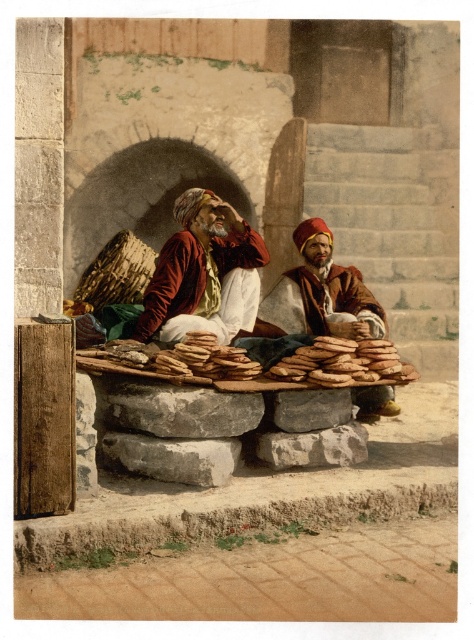
Question: Is matte red turban at center wider than brown leather turban at center?

Choices:
 (A) yes
 (B) no

Answer: (B)

Question: Is matte red turban at center in front of brown leather turban at center?

Choices:
 (A) no
 (B) yes

Answer: (B)

Question: Does matte red turban at center have a greater width compared to brown leather turban at center?

Choices:
 (A) yes
 (B) no

Answer: (B)

Question: Which object appears closest to the camera in this image?

Choices:
 (A) brown leather turban at center
 (B) matte red turban at center

Answer: (B)

Question: Among these points, which one is nearest to the camera?

Choices:
 (A) (277, 323)
 (B) (247, 248)

Answer: (B)

Question: Which of the following is the farthest from the observer?

Choices:
 (A) matte red turban at center
 (B) brown leather turban at center

Answer: (B)